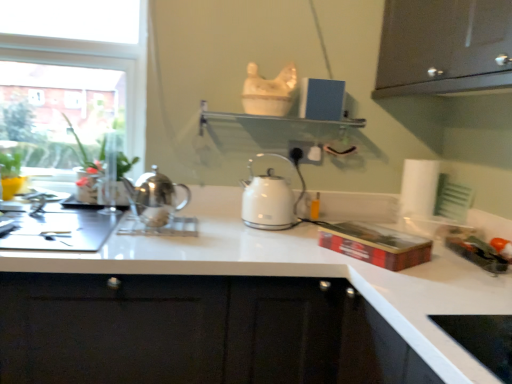
Image resolution: width=512 pixels, height=384 pixels. What are the coordinates of `free space to the left of white glossy kettle at center, placed as the 1th kettle when sorted from back to front` in the screenshot? It's located at (218, 221).